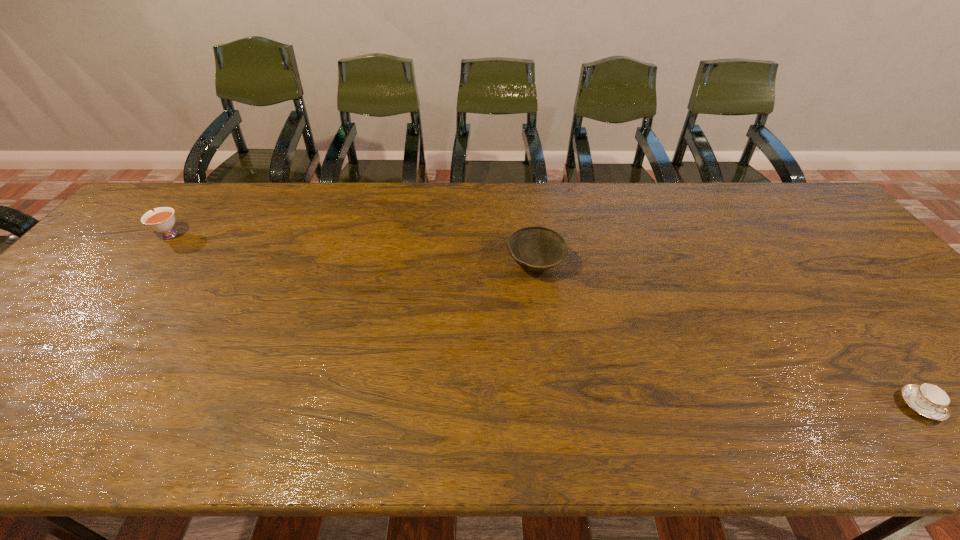
Find the location of `object at the right edge`. object at the right edge is located at coordinates (928, 400).

Find the location of `object at the near right corner`. object at the near right corner is located at coordinates (928, 400).

The height and width of the screenshot is (540, 960). Identify the location of free point at the far edge. (512, 208).

Where is `vacant space at the near edge`? vacant space at the near edge is located at coordinates (509, 435).

Image resolution: width=960 pixels, height=540 pixels. In the image, there is a desktop. Identify the location of vacant space at the left edge. (134, 226).

The height and width of the screenshot is (540, 960). What are the coordinates of `vacant point at the right edge` in the screenshot? It's located at (886, 327).

This screenshot has height=540, width=960. Find the location of `vacant space in between the bowl and the nearer teacup`. vacant space in between the bowl and the nearer teacup is located at coordinates (728, 335).

The height and width of the screenshot is (540, 960). In order to click on empty location between the bowl and the shortest object in this screenshot , I will do `click(728, 335)`.

Locate an element on the screen. The width and height of the screenshot is (960, 540). free space between the second object from left to right and the left teacup is located at coordinates (351, 250).

This screenshot has width=960, height=540. What are the coordinates of `free space between the taller teacup and the second object from left to right` in the screenshot? It's located at (351, 250).